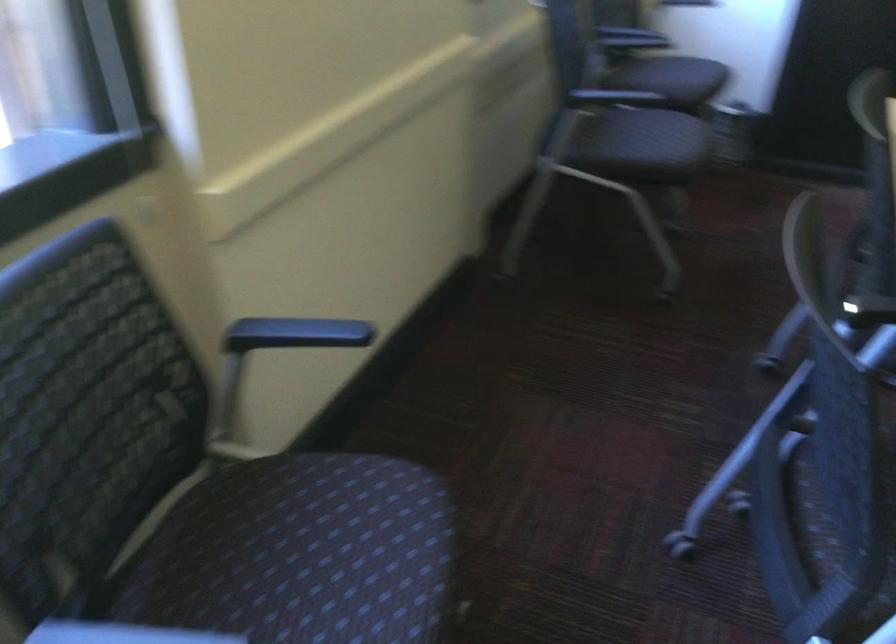
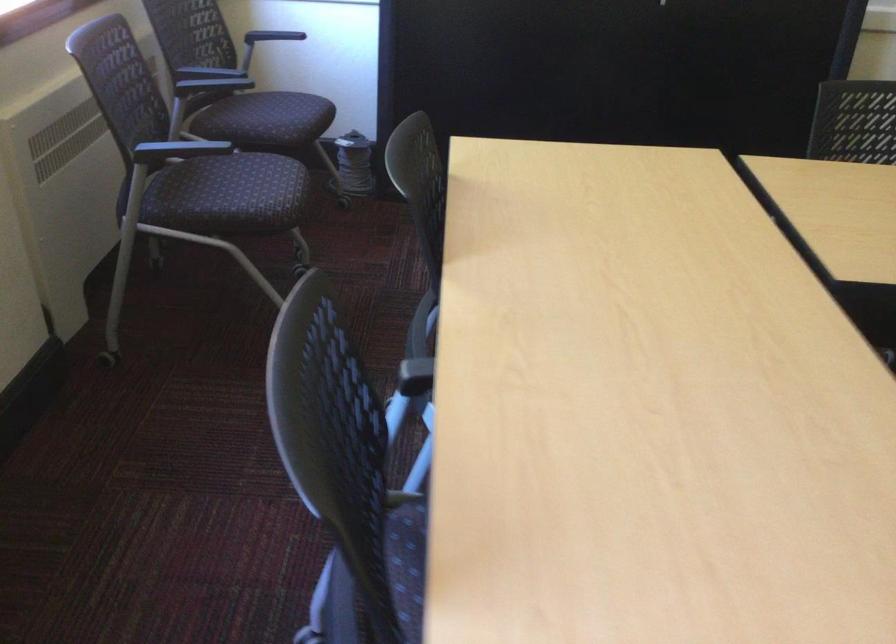
Where in the second image is the point corresponding to (x=656, y=147) from the first image?

(250, 198)